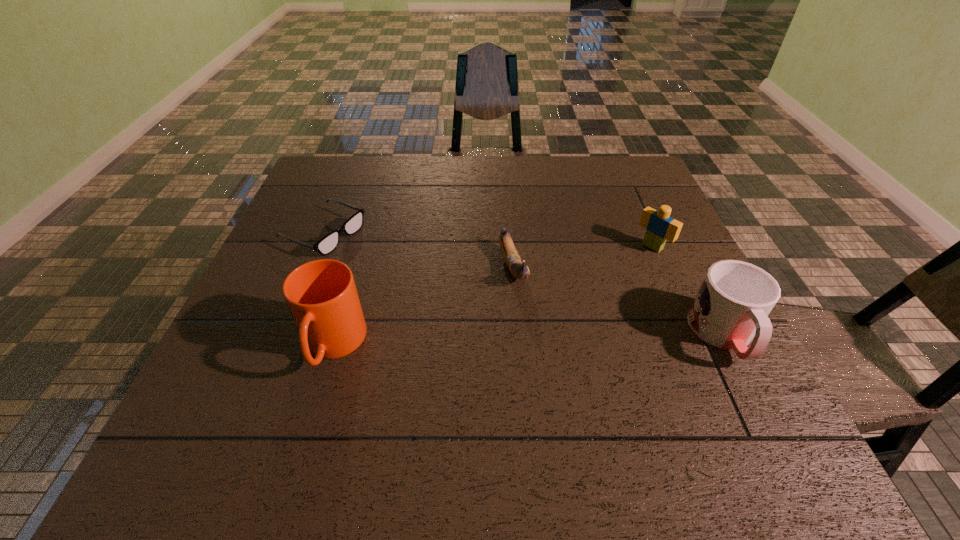
Where is `object situated at the near left corner`? The width and height of the screenshot is (960, 540). object situated at the near left corner is located at coordinates (322, 297).

Locate an element on the screen. The image size is (960, 540). object that is at the near right corner is located at coordinates (731, 308).

The width and height of the screenshot is (960, 540). Find the location of `free space at the far edge of the desktop`. free space at the far edge of the desktop is located at coordinates (493, 168).

In the image, there is a desktop. Find the location of `vacant area at the near edge`. vacant area at the near edge is located at coordinates (661, 399).

This screenshot has width=960, height=540. Identify the location of free space at the left edge of the desktop. (324, 210).

What are the coordinates of `vacant space at the right edge of the desktop` in the screenshot? It's located at (627, 199).

At what (x,y) coordinates should I click in order to perform the action: click on vacant space at the near right corner. Please return your answer as a coordinate pair (x, y). This screenshot has width=960, height=540. Looking at the image, I should click on (716, 384).

The width and height of the screenshot is (960, 540). Find the location of `vacant region between the spectacles and the second shortest object`. vacant region between the spectacles and the second shortest object is located at coordinates (419, 250).

Where is `free point between the right mug and the banana`? free point between the right mug and the banana is located at coordinates (618, 301).

This screenshot has height=540, width=960. Identify the location of vacant space in between the Lego and the third object from left to right. (583, 257).